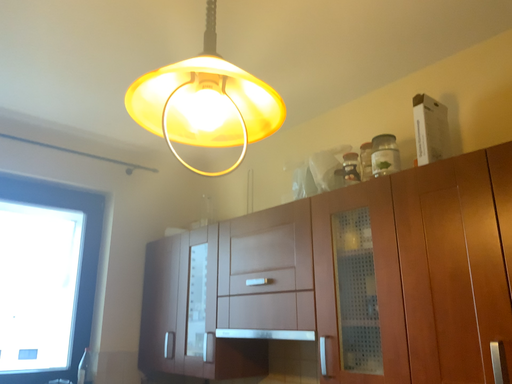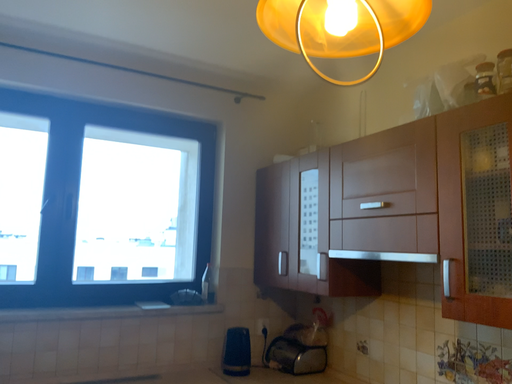
Question: How did the camera likely rotate when shooting the video?

Choices:
 (A) rotated upward
 (B) rotated downward

Answer: (B)